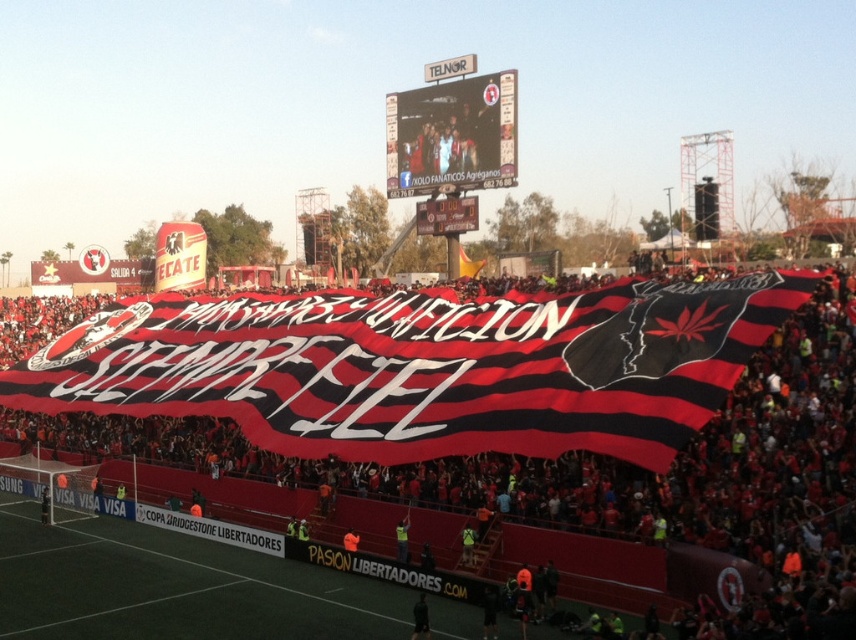
Does black and red striped banner at center appear over matte plastic scoreboard at upper center?

Actually, black and red striped banner at center is below matte plastic scoreboard at upper center.

Between black and red striped banner at center and matte plastic scoreboard at upper center, which one appears on the right side from the viewer's perspective?

matte plastic scoreboard at upper center is more to the right.

Is point (595, 324) behind point (415, 93)?

That is False.

At what (x,y) coordinates should I click in order to perform the action: click on black and red striped banner at center. Please return your answer as a coordinate pair (x, y). The height and width of the screenshot is (640, 856). Looking at the image, I should click on (423, 365).